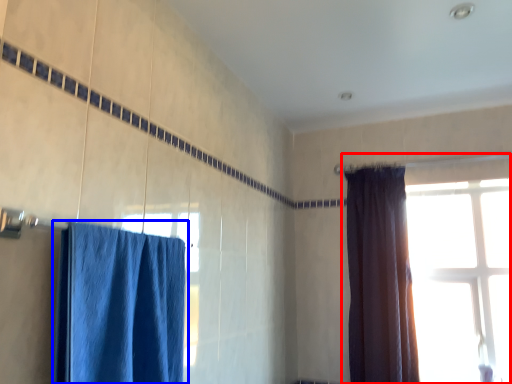
Question: Which object is further to the camera taking this photo, window (highlighted by a red box) or curtain (highlighted by a blue box)?

Choices:
 (A) window
 (B) curtain

Answer: (A)